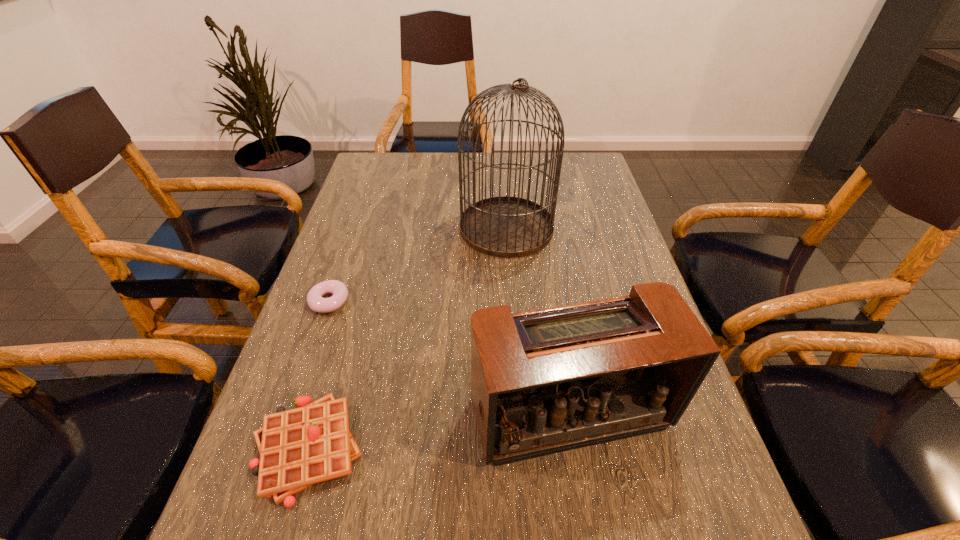
This screenshot has width=960, height=540. I want to click on free space that satisfies the following two spatial constraints: 1. on the back side of the farthest object; 2. on the right side of the waffle, so click(x=372, y=228).